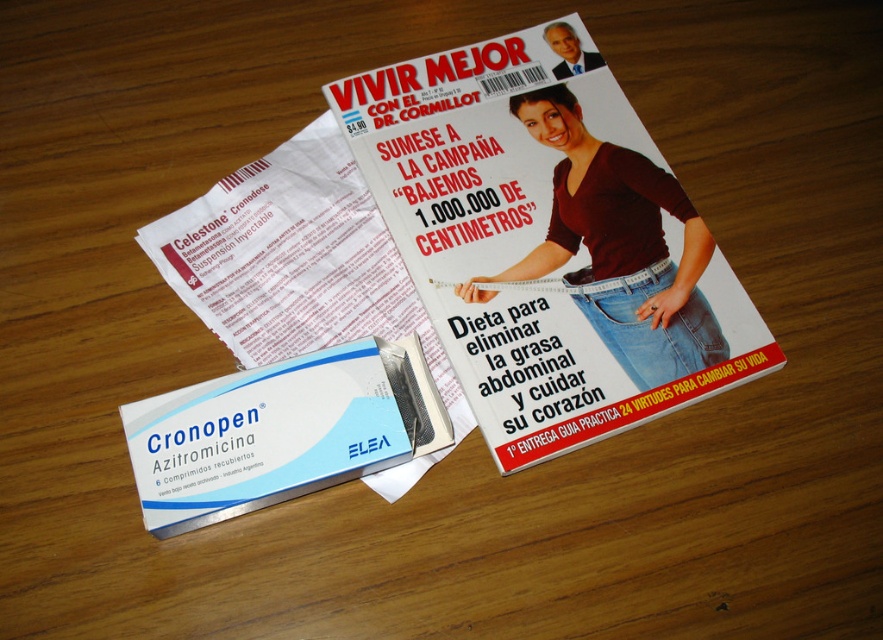
Question: Observing the image, what is the correct spatial positioning of white paper at center in reference to jeans at center?

Choices:
 (A) above
 (B) below

Answer: (B)

Question: Which of the following is the farthest from the observer?

Choices:
 (A) (263, 380)
 (B) (380, 273)
 (C) (600, 339)

Answer: (B)

Question: Which object is positioned closest to the white paper at center?

Choices:
 (A) jeans at center
 (B) matte paper magazine at center
 (C) blue cardboard box at lower left

Answer: (C)

Question: Which of the following is the farthest from the observer?

Choices:
 (A) (565, 20)
 (B) (151, 486)
 (C) (646, 192)
 (D) (242, 320)

Answer: (A)

Question: Is white paper at center positioned at the back of jeans at center?

Choices:
 (A) yes
 (B) no

Answer: (B)

Question: Can you confirm if white paper at center is positioned to the left of blue cardboard box at lower left?

Choices:
 (A) no
 (B) yes

Answer: (A)